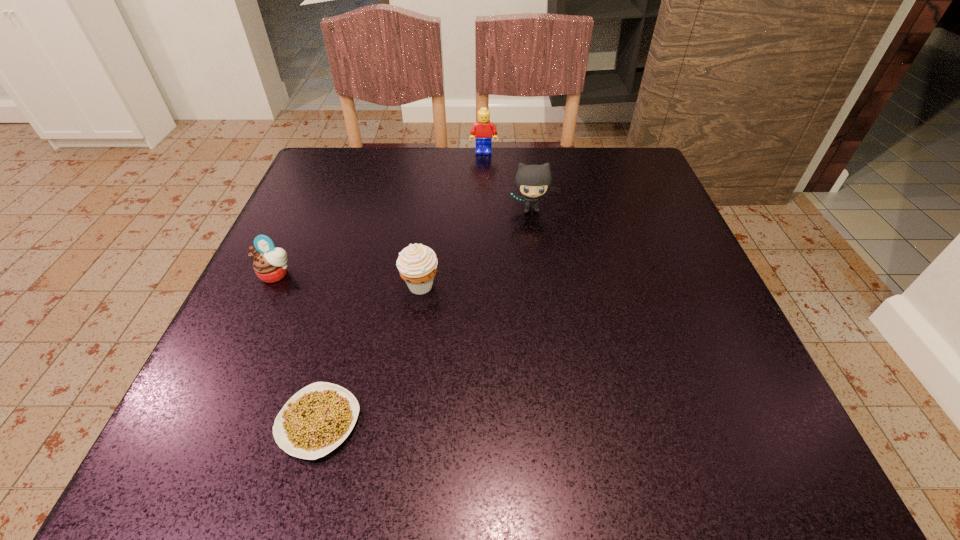
You are a GUI agent. You are given a task and a screenshot of the screen. Output one action in this format:
    pyautogui.click(x=<x>, y=<y>)
    Task: Click on the farthest object
    
    Given the screenshot: What is the action you would take?
    (x=483, y=129)

Image resolution: width=960 pixels, height=540 pixels. I want to click on Lego, so click(483, 129).

Locate an element on the screen. The image size is (960, 540). the fourth nearest object is located at coordinates (532, 181).

The height and width of the screenshot is (540, 960). Identify the location of the rightmost object. (532, 181).

Image resolution: width=960 pixels, height=540 pixels. In order to click on the right muffin in this screenshot , I will do `click(417, 263)`.

Identify the location of the taller muffin. (417, 263).

This screenshot has width=960, height=540. Find the location of `the fourth tallest object`. the fourth tallest object is located at coordinates pos(269,264).

Locate an element on the screen. The height and width of the screenshot is (540, 960). the left muffin is located at coordinates (269, 264).

The height and width of the screenshot is (540, 960). I want to click on legume, so click(317, 419).

Where is `the second object from left to right`? the second object from left to right is located at coordinates (317, 419).